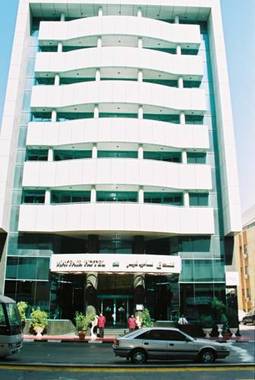
Image resolution: width=255 pixels, height=380 pixels. In order to click on window in this screenshot , I will do `click(204, 274)`.